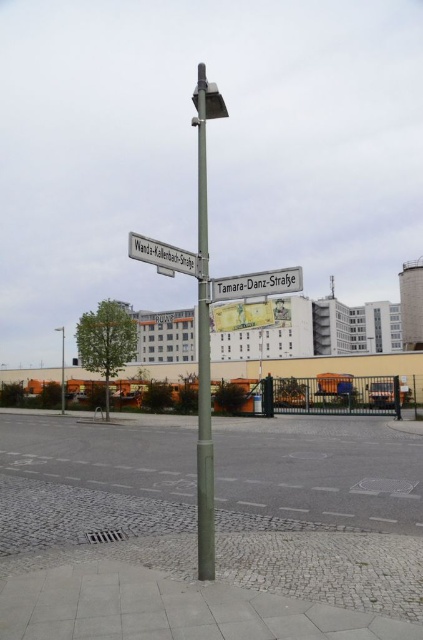
Does metallic silver street sign at center have a lesser height compared to matte green pole at center?

Yes.

Is point (266, 289) positioned in front of point (62, 330)?

Yes, point (266, 289) is in front of point (62, 330).

You are a GUI agent. You are given a task and a screenshot of the screen. Output one action in this format:
    pyautogui.click(x=<x>, y=<y>)
    Task: Click on the metallic silver street sign at center
    This screenshot has width=423, height=640.
    Given the screenshot: What is the action you would take?
    pyautogui.click(x=257, y=284)

At what (x,y) coordinates should I click in order to perform the action: click on metallic silver street sign at center. Please return your answer as a coordinate pair (x, y). This screenshot has height=640, width=423. Looking at the image, I should click on (257, 284).

Between point (175, 493) and point (216, 301), which one is positioned in front?

Point (216, 301)

Does point (302, 486) come in front of point (233, 280)?

No, it is behind (233, 280).

Image resolution: width=423 pixels, height=640 pixels. Find the location of `gray cobblestone parking lot at lower center`. gray cobblestone parking lot at lower center is located at coordinates (321, 470).

Is the position of metallic silver street sign at center less distant than that of white plastic street sign at upper left?

No, metallic silver street sign at center is behind white plastic street sign at upper left.

Who is lower down, metallic silver street sign at center or white plastic street sign at upper left?

Positioned lower is metallic silver street sign at center.

Is point (244, 276) positioned before point (156, 250)?

No, it is behind (156, 250).

Image resolution: width=423 pixels, height=640 pixels. In order to click on metallic silver street sign at center in this screenshot , I will do `click(257, 284)`.